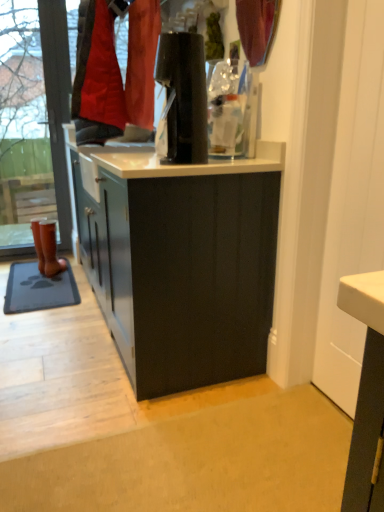
Describe the element at coordinates (57, 103) in the screenshot. Image resolution: width=384 pixels, height=512 pixels. I see `transparent glass shop window at left` at that location.

This screenshot has height=512, width=384. I want to click on brown leather boot at left, so click(50, 249).

Is transparent glass shop window at left not close to matte red curtain at upper center?

Yes, transparent glass shop window at left and matte red curtain at upper center are quite far apart.

Which is farther, (x=65, y=16) or (x=251, y=26)?

Point (x=65, y=16)

Which is more to the left, transparent glass shop window at left or matte red curtain at upper center?

transparent glass shop window at left.

Which object is wider, transparent glass shop window at left or matte red curtain at upper center?

With larger width is transparent glass shop window at left.

Who is taller, matte red curtain at upper center or brown leather boot at left?

brown leather boot at left is taller.

In the scene shown: From a real-world perspective, is matte red curtain at upper center located beneath brown leather boot at left?

No, from a real-world perspective, matte red curtain at upper center is not below brown leather boot at left.

Is matte red curtain at upper center oriented towards brown leather boot at left?

No, matte red curtain at upper center does not turn towards brown leather boot at left.

Is gray rubber mat at lower left next to transparent glass shop window at left and touching it?

No, gray rubber mat at lower left is not beside transparent glass shop window at left.

Where is `mat on the right of transparent glass shop window at left`? mat on the right of transparent glass shop window at left is located at coordinates (38, 289).

How distant is gray rubber mat at lower left from transparent glass shop window at left?

They are 79.42 centimeters apart.

From the image's perspective, is brown leather boot at left located above matte red curtain at upper center?

No, from the image's perspective, brown leather boot at left is not on top of matte red curtain at upper center.

Is brown leather boot at left positioned with its back to matte red curtain at upper center?

brown leather boot at left does not have its back to matte red curtain at upper center.

Which object is positioned more to the right, brown leather boot at left or matte red curtain at upper center?

→ matte red curtain at upper center.

Considering the sizes of objects transparent glass shop window at left and brown leather boot at left in the image provided, who is smaller, transparent glass shop window at left or brown leather boot at left?

brown leather boot at left.

Considering the positions of points (65, 158) and (54, 271), is point (65, 158) closer to camera compared to point (54, 271)?

No.

From a real-world perspective, is transparent glass shop window at left positioned over brown leather boot at left based on gravity?

Yes.

The height and width of the screenshot is (512, 384). I want to click on footwear located on the right of transparent glass shop window at left, so click(50, 249).

Which is more to the left, brown leather boot at left or gray rubber mat at lower left?

Positioned to the left is gray rubber mat at lower left.

Is brown leather boot at left further to the viewer compared to gray rubber mat at lower left?

Yes, it is.

Considering the positions of point (44, 231) and point (51, 300), is point (44, 231) closer or farther from the camera than point (51, 300)?

Clearly, point (44, 231) is more distant from the camera than point (51, 300).

Looking at this image, from the image's perspective, is brown leather boot at left located above or below gray rubber mat at lower left?

Based on their image positions, brown leather boot at left is located above gray rubber mat at lower left.

Who is bigger, gray rubber mat at lower left or matte red curtain at upper center?

Bigger between the two is gray rubber mat at lower left.

Is gray rubber mat at lower left touching matte red curtain at upper center?

There is a gap between gray rubber mat at lower left and matte red curtain at upper center.

Between gray rubber mat at lower left and matte red curtain at upper center, which one is positioned behind?

Positioned behind is gray rubber mat at lower left.

Consider the image. Considering the relative positions of gray rubber mat at lower left and matte red curtain at upper center in the image provided, is gray rubber mat at lower left to the left of matte red curtain at upper center from the viewer's perspective?

Indeed, gray rubber mat at lower left is positioned on the left side of matte red curtain at upper center.

The image size is (384, 512). In order to click on curtain that is in front of the transparent glass shop window at left in this screenshot , I will do `click(257, 28)`.

Find the location of `curtain positioned vertically above the brown leather boot at left (from a real-world perspective)`. curtain positioned vertically above the brown leather boot at left (from a real-world perspective) is located at coordinates (257, 28).

Looking at the image, which one is located further to brown leather boot at left, gray rubber mat at lower left or transparent glass shop window at left?

transparent glass shop window at left is further to brown leather boot at left.

Which object lies nearer to the anchor point matte red curtain at upper center, gray rubber mat at lower left or brown leather boot at left?

gray rubber mat at lower left lies closer to matte red curtain at upper center than the other object.

Based on their spatial positions, is matte red curtain at upper center or brown leather boot at left closer to gray rubber mat at lower left?

Among the two, brown leather boot at left is located nearer to gray rubber mat at lower left.

Which object lies nearer to the anchor point transparent glass shop window at left, brown leather boot at left or matte red curtain at upper center?

brown leather boot at left lies closer to transparent glass shop window at left than the other object.

Which object lies further to the anchor point transparent glass shop window at left, brown leather boot at left or gray rubber mat at lower left?

gray rubber mat at lower left is further to transparent glass shop window at left.

Looking at the image, which one is located closer to transparent glass shop window at left, gray rubber mat at lower left or matte red curtain at upper center?

The object closer to transparent glass shop window at left is gray rubber mat at lower left.

When comparing their distances from gray rubber mat at lower left, does transparent glass shop window at left or matte red curtain at upper center seem closer?

transparent glass shop window at left is closer to gray rubber mat at lower left.

Based on their spatial positions, is matte red curtain at upper center or brown leather boot at left closer to transparent glass shop window at left?

brown leather boot at left.

Where is `footwear between transparent glass shop window at left and gray rubber mat at lower left in the vertical direction`? footwear between transparent glass shop window at left and gray rubber mat at lower left in the vertical direction is located at coordinates (50, 249).

The width and height of the screenshot is (384, 512). I want to click on footwear between transparent glass shop window at left and matte red curtain at upper center, so click(50, 249).

Find the location of `mat between transparent glass shop window at left and matte red curtain at upper center`. mat between transparent glass shop window at left and matte red curtain at upper center is located at coordinates (38, 289).

The width and height of the screenshot is (384, 512). What are the coordinates of `mat between matte red curtain at upper center and brown leather boot at left from front to back` in the screenshot? It's located at (38, 289).